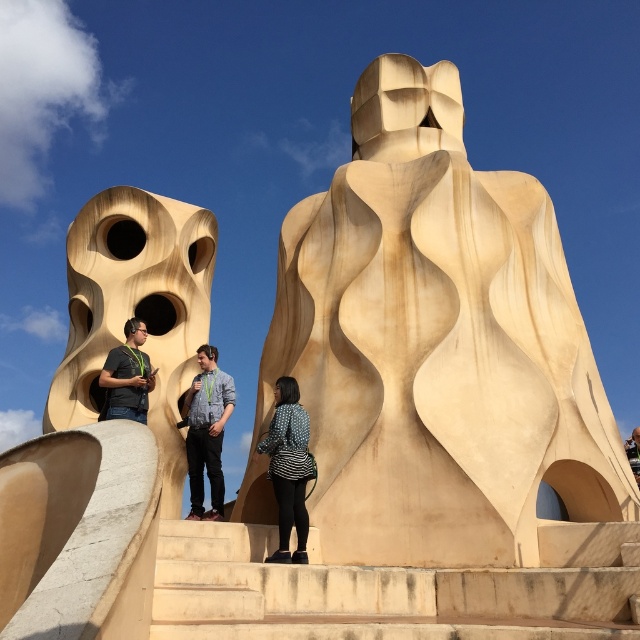
You are standing at the entrance of the architectural structure and want to reach the observation deck located at the top of the beige stone stairs at center. According to the coordinates provided, is the stairs centrally positioned to ensure a direct path upwards?

The beige stone stairs at center is located at point (392, 589), which suggests it is centrally positioned, providing a direct path upwards to the observation deck.

You are a photographer planning to capture the beige smooth sculpture at center and the patterned fabric coat at center in the same frame. Based on their sizes, which object should you focus on first to ensure both are in focus?

The beige smooth sculpture at center is taller than the patterned fabric coat at center, so you should focus on the sculpture first to ensure both are in focus.